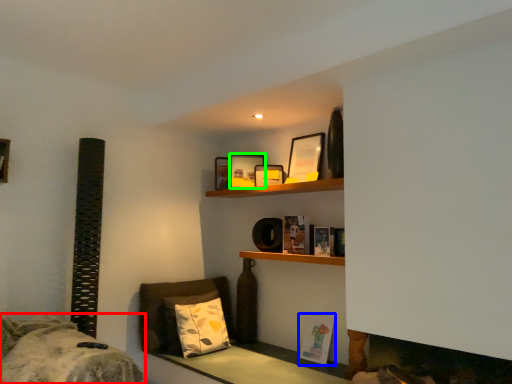
Question: Which is farther away from bed (highlighted by a red box)? book (highlighted by a blue box) or picture frame (highlighted by a green box)?

Choices:
 (A) book
 (B) picture frame

Answer: (B)